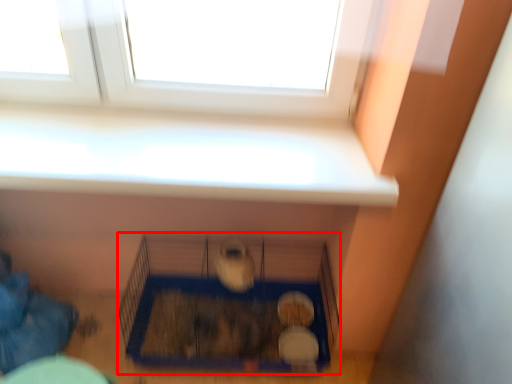
Question: Considering the relative positions of bird cage (annotated by the red box) and window in the image provided, where is bird cage (annotated by the red box) located with respect to the staircase?

Choices:
 (A) right
 (B) left

Answer: (A)